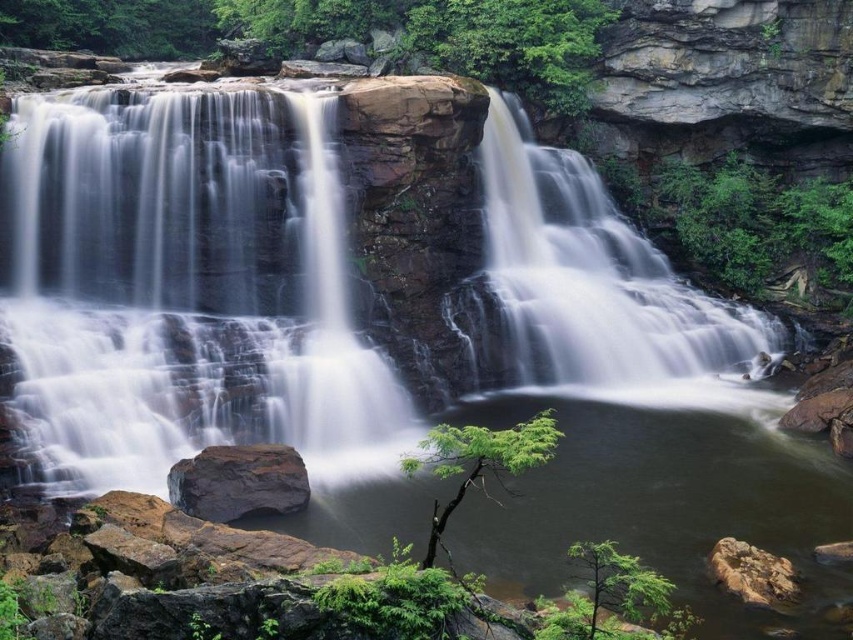
Question: From the image, what is the correct spatial relationship of white smooth waterfall at left in relation to smooth dark rock at center?

Choices:
 (A) right
 (B) left

Answer: (B)

Question: Which object is positioned closest to the smooth dark rock at center?

Choices:
 (A) rough textured rock at lower right
 (B) white smooth waterfall at upper right
 (C) white smooth waterfall at left

Answer: (C)

Question: Is white smooth waterfall at left positioned in front of rough textured rock at lower right?

Choices:
 (A) no
 (B) yes

Answer: (A)

Question: Which of the following is the farthest from the observer?

Choices:
 (A) rough textured rock at lower right
 (B) white smooth waterfall at upper right
 (C) smooth dark rock at center
 (D) white smooth waterfall at left

Answer: (B)

Question: Does white smooth waterfall at left have a lesser width compared to rough textured rock at lower right?

Choices:
 (A) no
 (B) yes

Answer: (A)

Question: Which is farther from the white smooth waterfall at upper right?

Choices:
 (A) rough textured rock at lower right
 (B) smooth dark rock at center
 (C) white smooth waterfall at left

Answer: (A)